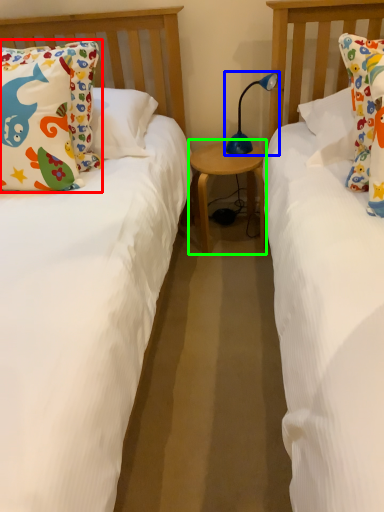
Question: Estimate the real-world distances between objects in this image. Which object is farther from pillow (highlighted by a red box), table lamp (highlighted by a blue box) or table (highlighted by a green box)?

Choices:
 (A) table lamp
 (B) table

Answer: (A)